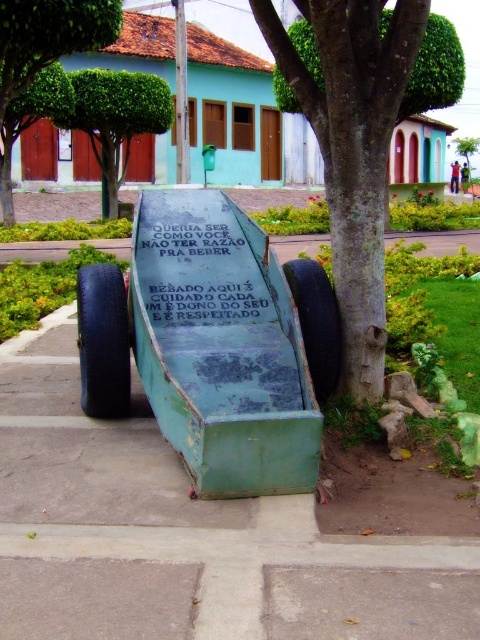
Question: Can you confirm if green painted wood cart at center is smaller than green leafy tree at upper left?

Choices:
 (A) yes
 (B) no

Answer: (A)

Question: Which is nearer to the green painted wood cart at center?

Choices:
 (A) black rubber tire at lower left
 (B) rubber tire at lower center
 (C) green painted wood sign at center
 (D) green rough bark tree at center

Answer: (A)

Question: Which object is positioned closest to the green painted wood sign at center?

Choices:
 (A) green painted metal sign at center
 (B) black rubber tire at lower left

Answer: (A)

Question: Does green painted wood cart at center appear on the left side of green leafy tree at center?

Choices:
 (A) yes
 (B) no

Answer: (B)

Question: Which object is the closest to the rubber tire at lower center?

Choices:
 (A) green painted wood cart at center
 (B) green leafy tree at center
 (C) black rubber tire at lower left
 (D) green painted metal sign at center

Answer: (D)

Question: From the image, what is the correct spatial relationship of green leafy tree at center in relation to green leafy tree at upper left?

Choices:
 (A) below
 (B) above

Answer: (A)